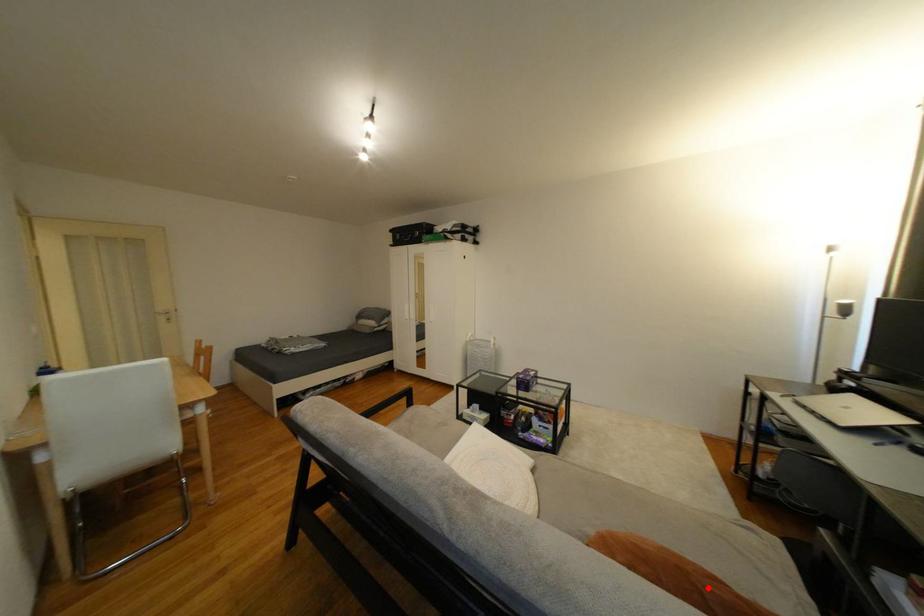
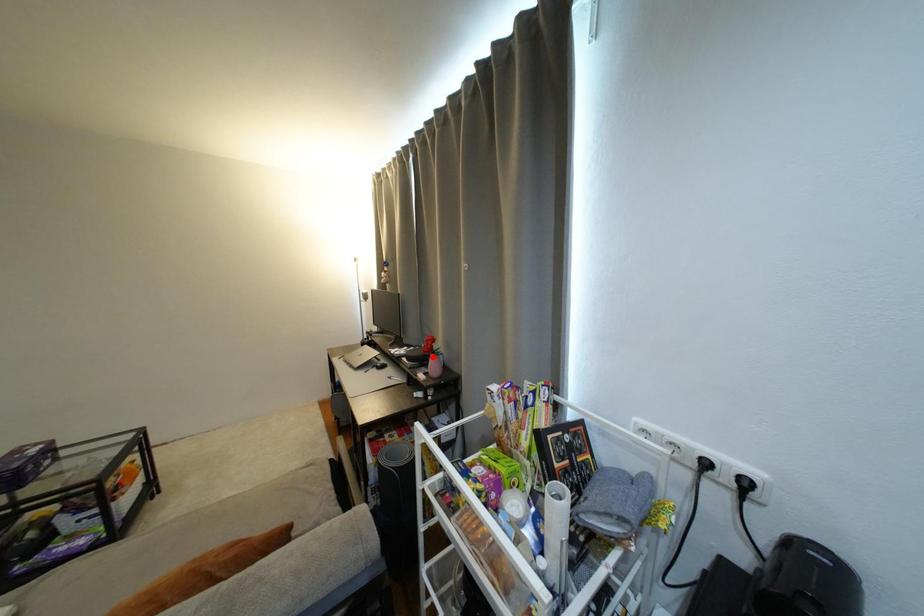
I am providing you with two images of the same scene from different viewpoints. A red point is marked on the first image and another point is marked on the second image. Are the points marked in image1 and image2 representing the same 3D position?

No